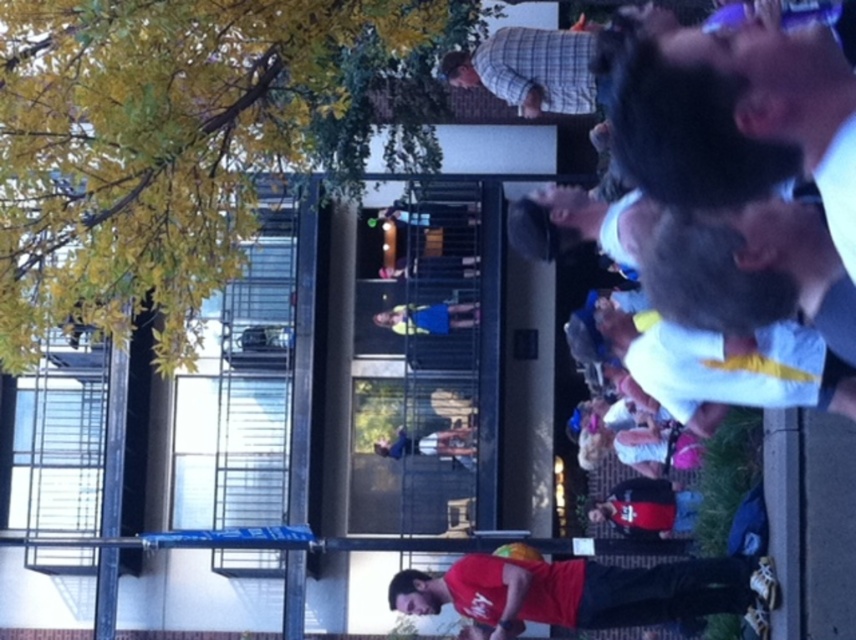
You are standing in the outdoor gathering area and want to take a photo of both the yellow leafy tree at upper left and the red matte shirt at lower center. Which object should you focus on first to ensure both are in clear view?

You should focus on the yellow leafy tree at upper left first because it is closer to you than the red matte shirt at lower center, so adjusting focus from near to far will help both be in clear view.

You are standing at the center of the scene and want to locate the yellow leafy tree at upper left. According to the coordinates given, in which direction should you look to find it?

The yellow leafy tree at upper left is located at coordinates point (x=186, y=140), so you should look towards the upper left direction to find it.

You are standing in the outdoor gathering area near the building. You see a yellow leafy tree at upper left and a blue fabric dress at center. Which object is positioned to the left of the other?

The yellow leafy tree at upper left is to the left of the blue fabric dress at center.